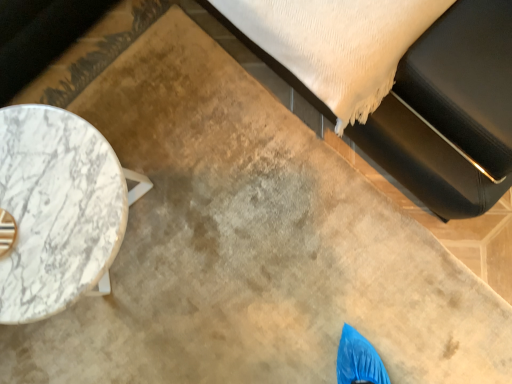
Question: Considering the positions of point (26, 205) and point (483, 24), is point (26, 205) closer or farther from the camera than point (483, 24)?

Choices:
 (A) closer
 (B) farther

Answer: (A)

Question: Based on their sizes in the image, would you say white marble table at left is bigger or smaller than black leather bed at upper right?

Choices:
 (A) small
 (B) big

Answer: (A)

Question: In terms of width, does white marble table at left look wider or thinner when compared to black leather bed at upper right?

Choices:
 (A) thin
 (B) wide

Answer: (A)

Question: From the image's perspective, is black leather bed at upper right above or below white marble table at left?

Choices:
 (A) above
 (B) below

Answer: (A)

Question: From a real-world perspective, is black leather bed at upper right above or below white marble table at left?

Choices:
 (A) below
 (B) above

Answer: (B)

Question: In terms of height, does black leather bed at upper right look taller or shorter compared to white marble table at left?

Choices:
 (A) tall
 (B) short

Answer: (A)

Question: Considering the positions of point (406, 61) and point (92, 291), is point (406, 61) closer or farther from the camera than point (92, 291)?

Choices:
 (A) farther
 (B) closer

Answer: (B)